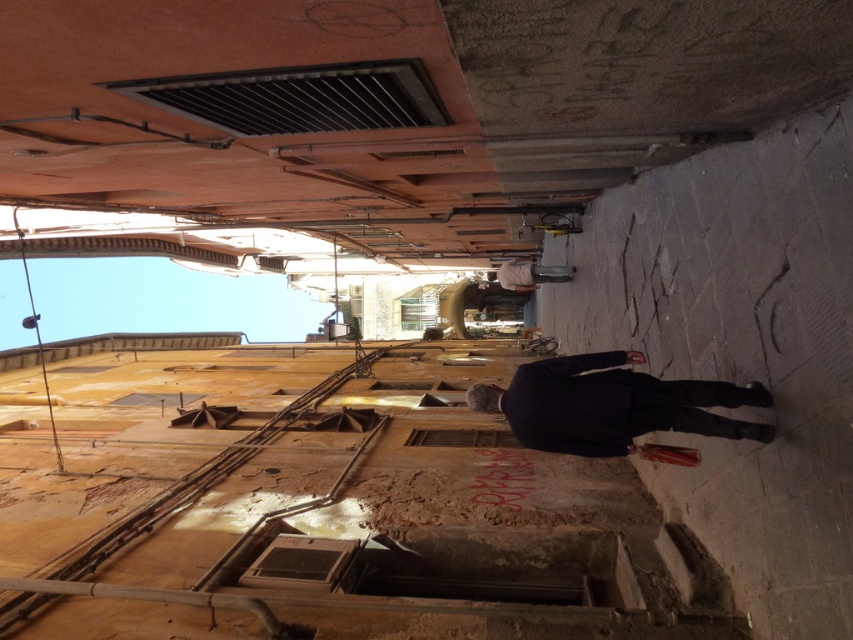
Does rustic stone steps at lower right have a greater height compared to dark blue suit at center?

Yes, rustic stone steps at lower right is taller than dark blue suit at center.

Does point (469, 429) come closer to viewer compared to point (712, 387)?

No, (469, 429) is further to viewer.

At what (x,y) coordinates should I click in order to perform the action: click on rustic stone steps at lower right. Please return your answer as a coordinate pair (x, y). The image size is (853, 640). Looking at the image, I should click on (326, 509).